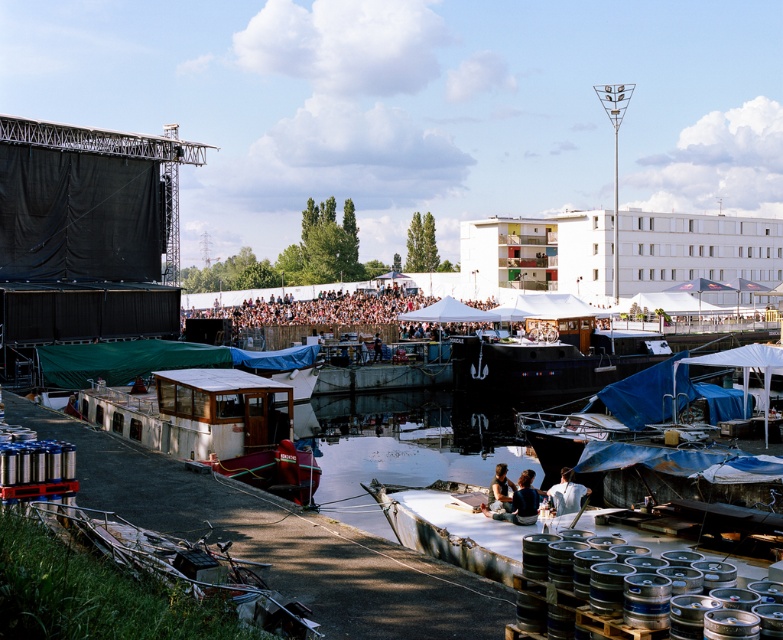
Question: Where is matte white shirt at center located in relation to white cotton shirt at lower center in the image?

Choices:
 (A) left
 (B) right

Answer: (A)

Question: Is blue tarpaulin boat at lower right to the right of matte white shirt at center from the viewer's perspective?

Choices:
 (A) yes
 (B) no

Answer: (A)

Question: Does blue tarpaulin boat at lower right appear under matte blue shirt at center?

Choices:
 (A) no
 (B) yes

Answer: (A)

Question: Which point is closer to the camera?

Choices:
 (A) (406, 509)
 (B) (246, 378)
 (C) (543, 429)
 (D) (565, 497)

Answer: (D)

Question: Which of the following is the farthest from the observer?

Choices:
 (A) (446, 538)
 (B) (581, 410)

Answer: (B)

Question: Which object is farther from the camera taking this photo?

Choices:
 (A) matte blue shirt at center
 (B) matte white shirt at center
 (C) white wooden boat at center

Answer: (C)